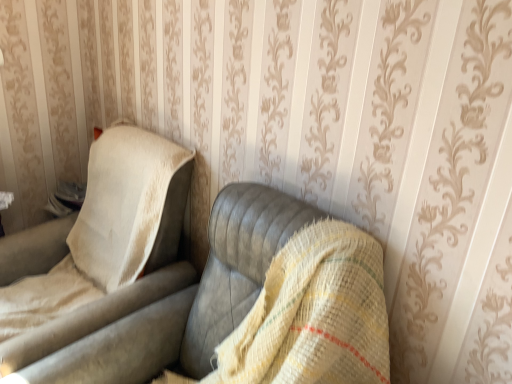
Question: From the image's perspective, is leather-like gray couch at center located above or below beige fabric chair at left?

Choices:
 (A) above
 (B) below

Answer: (B)

Question: Relative to beige fabric chair at left, is leather-like gray couch at center in front or behind?

Choices:
 (A) behind
 (B) front

Answer: (B)

Question: In terms of size, does leather-like gray couch at center appear bigger or smaller than beige fabric chair at left?

Choices:
 (A) big
 (B) small

Answer: (B)

Question: Looking at the image, does beige fabric chair at left seem bigger or smaller compared to leather-like gray couch at center?

Choices:
 (A) small
 (B) big

Answer: (B)

Question: Considering the positions of point (74, 321) and point (194, 364), is point (74, 321) closer or farther from the camera than point (194, 364)?

Choices:
 (A) farther
 (B) closer

Answer: (B)

Question: From the image's perspective, is beige fabric chair at left above or below leather-like gray couch at center?

Choices:
 (A) below
 (B) above

Answer: (B)

Question: Is beige fabric chair at left taller or shorter than leather-like gray couch at center?

Choices:
 (A) tall
 (B) short

Answer: (B)